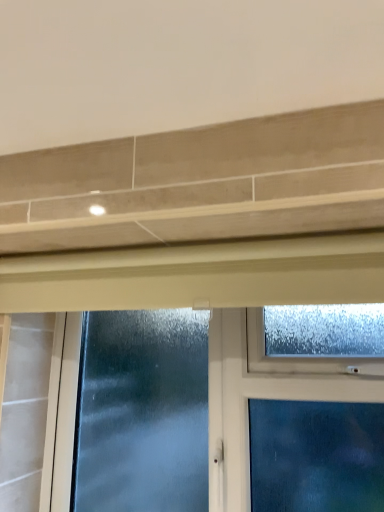
What do you see at coordinates (200, 275) in the screenshot? I see `frosted glass window at center` at bounding box center [200, 275].

Find the location of a particular element. The image size is (384, 512). frosted glass window at center is located at coordinates (200, 275).

At what (x,y) coordinates should I click in order to perform the action: click on frosted glass window at center. Please return your answer as a coordinate pair (x, y). Image resolution: width=384 pixels, height=512 pixels. Looking at the image, I should click on (200, 275).